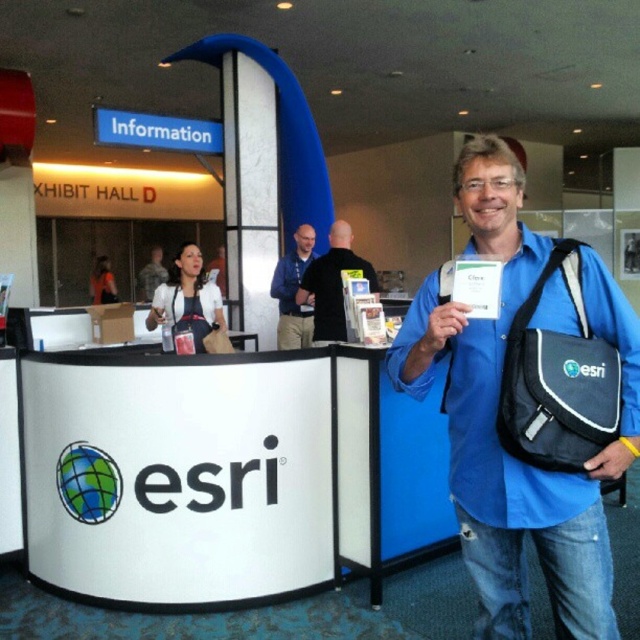
Which is behind, point (589, 538) or point (339, 307)?

The point (339, 307) is more distant.

Can you confirm if blue fabric shirt at center is shorter than black matte shirt at center?

No, blue fabric shirt at center is not shorter than black matte shirt at center.

Locate an element on the screen. Image resolution: width=640 pixels, height=640 pixels. blue fabric shirt at center is located at coordinates (493, 417).

Locate an element on the screen. The width and height of the screenshot is (640, 640). blue fabric shirt at center is located at coordinates (493, 417).

Based on the photo, can you confirm if blue shirt at center is positioned to the left of camouflage uniform at center?

Incorrect, blue shirt at center is not on the left side of camouflage uniform at center.

Can you confirm if blue shirt at center is bigger than camouflage uniform at center?

Incorrect, blue shirt at center is not larger than camouflage uniform at center.

Where is `blue shirt at center`? blue shirt at center is located at coordinates (292, 292).

You are a GUI agent. You are given a task and a screenshot of the screen. Output one action in this format:
    pyautogui.click(x=<x>, y=<y>)
    Task: Click on the blue shirt at center
    The image size is (640, 640).
    Given the screenshot: What is the action you would take?
    pyautogui.click(x=292, y=292)

Can you confirm if black matte shirt at center is positioned above blue shirt at center?

No.

Can you confirm if black matte shirt at center is taller than blue shirt at center?

In fact, black matte shirt at center may be shorter than blue shirt at center.

Locate an element on the screen. This screenshot has height=640, width=640. black matte shirt at center is located at coordinates (332, 284).

The width and height of the screenshot is (640, 640). What are the coordinates of `black matte shirt at center` in the screenshot? It's located at (332, 284).